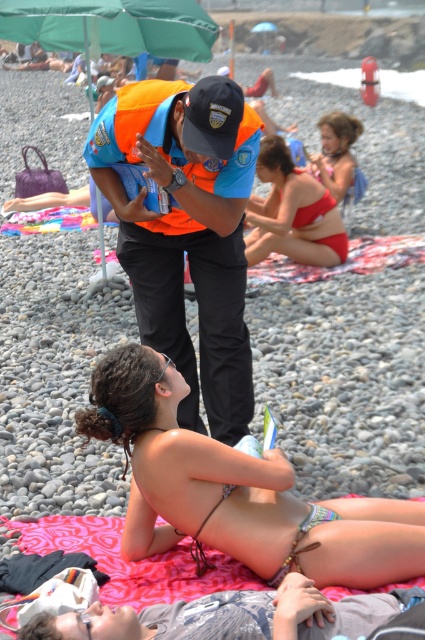
You are a photographer trying to capture a photo of the orange uniform at center and the green fabric umbrella at upper center. Which object should you zoom in more on to ensure both are clearly visible in the frame?

Since the orange uniform at center is smaller in size compared to the green fabric umbrella at upper center, you should zoom in more on the orange uniform at center to ensure both are clearly visible in the frame.

You are a beachgoer who wants to know if the red bikini bottom at center is bigger than the matte red bikini at upper right. Can you confirm this based on the scene?

The red bikini bottom at center is larger in size than matte red bikini at upper right, so yes, the red bikini bottom at center is bigger than the matte red bikini at upper right.

What is the color of the uniform of the person at the point with coordinates (187, 230)?

The point at coordinates (187, 230) corresponds to the orange uniform at center, so the uniform is orange.